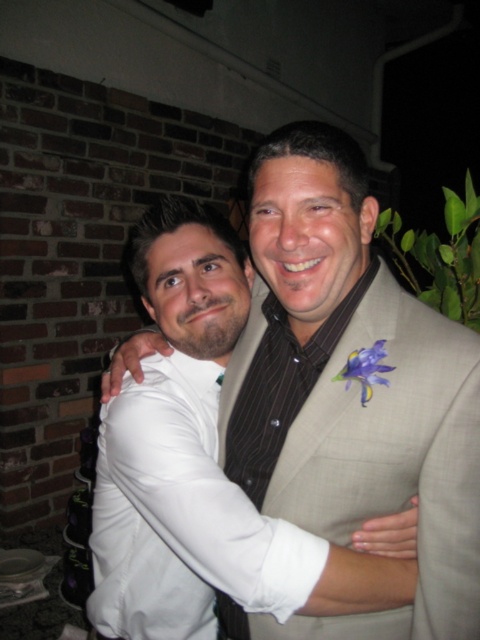
Question: Among these objects, which one is nearest to the camera?

Choices:
 (A) purple silk flower at center
 (B) white satin shirt at center
 (C) white satin dress at center

Answer: (B)

Question: Among these points, which one is nearest to the camera?

Choices:
 (A) [x=433, y=540]
 (B) [x=129, y=474]

Answer: (A)

Question: Is white satin dress at center above purple silk flower at center?

Choices:
 (A) no
 (B) yes

Answer: (A)

Question: Based on their relative distances, which object is farther from the white satin shirt at center?

Choices:
 (A) purple silk flower at center
 (B) white satin dress at center

Answer: (A)

Question: Can you confirm if white satin shirt at center is positioned above purple silk flower at center?

Choices:
 (A) yes
 (B) no

Answer: (B)

Question: Considering the relative positions of white satin shirt at center and purple silk flower at center in the image provided, where is white satin shirt at center located with respect to purple silk flower at center?

Choices:
 (A) right
 (B) left

Answer: (B)